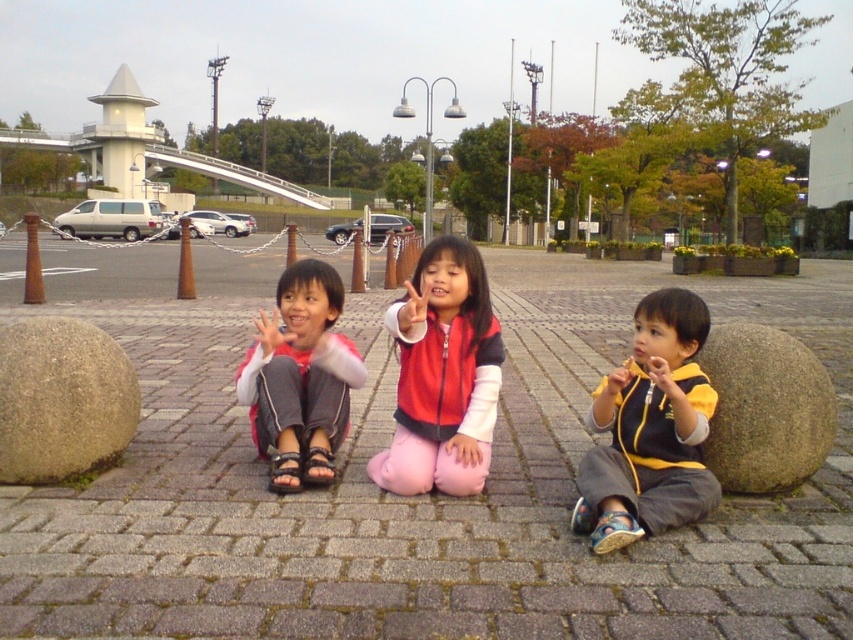
Is brick pavement at center to the left of pink fabric pants at center from the viewer's perspective?

In fact, brick pavement at center is to the right of pink fabric pants at center.

Does point (833, 269) come closer to viewer compared to point (274, 454)?

No, it is not.

The width and height of the screenshot is (853, 640). I want to click on brick pavement at center, so click(413, 497).

Is matte red vest at center below green stone boulder at lower right?

Actually, matte red vest at center is above green stone boulder at lower right.

Measure the distance between matte red vest at center and camera.

2.61 meters

You are a GUI agent. You are given a task and a screenshot of the screen. Output one action in this format:
    pyautogui.click(x=<x>, y=<y>)
    Task: Click on the matte red vest at center
    
    Given the screenshot: What is the action you would take?
    pyautogui.click(x=442, y=376)

Which is below, yellow fabric shirt at center or matte red vest at center?

yellow fabric shirt at center

Is point (648, 296) farther from viewer compared to point (401, 374)?

Yes, it is.

Does point (634, 518) come in front of point (463, 262)?

Yes.

Where is `yellow fabric shirt at center`? Image resolution: width=853 pixels, height=640 pixels. yellow fabric shirt at center is located at coordinates (650, 429).